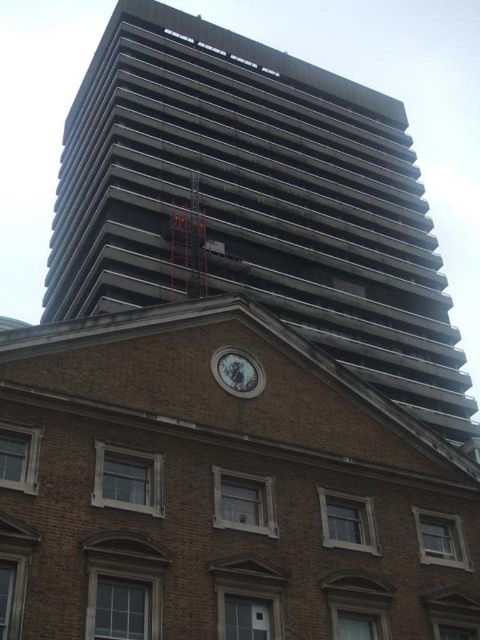
You are standing at the base of the dark gray concrete building at upper center and want to place a 100 foot tall statue between it and the white glossy clock at center. Will the statue fit without overlapping either structure?

The distance between the dark gray concrete building at upper center and the white glossy clock at center is 162.37 feet. Since the statue is 100 feet tall, it can be placed between them as the space is sufficient to accommodate its height without overlapping either structure.

You are an architect designing a new building that needs to fit between the dark gray concrete building at upper center and the white glossy clock at center. The new building must be narrower than both. Can you confirm if this is possible based on their widths?

The dark gray concrete building at upper center is wider than the white glossy clock at center. Since the new building must be narrower than both, it needs to be narrower than the narrower of the two. Therefore, the new building can be designed to fit between them as long as it is narrower than the white glossy clock at center.

You are standing in front of the traditional brick building and want to take a photo of the white glossy clock at center and the dark gray concrete building at upper center. Which object should you pan your camera to the left to include in the photo first?

You should pan your camera to the left first to include the dark gray concrete building at upper center because it is located to the left of the white glossy clock at center.